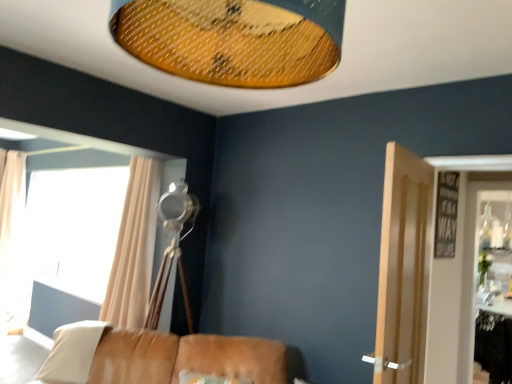
Question: From a real-world perspective, is beige fabric curtain at left, which ranks as the first curtain in left-to-right order, physically below white fabric pillow at lower left?

Choices:
 (A) no
 (B) yes

Answer: (A)

Question: Can you confirm if beige fabric curtain at left, which ranks as the first curtain in left-to-right order, is positioned to the right of white fabric pillow at lower left?

Choices:
 (A) no
 (B) yes

Answer: (A)

Question: Is beige fabric curtain at left, arranged as the 2th curtain when viewed from the right, thinner than white fabric pillow at lower left?

Choices:
 (A) no
 (B) yes

Answer: (B)

Question: Is beige fabric curtain at left, which ranks as the first curtain in left-to-right order, bigger than white fabric pillow at lower left?

Choices:
 (A) no
 (B) yes

Answer: (B)

Question: Is beige fabric curtain at left, which is the 2th curtain from front to back, closer to camera compared to white fabric pillow at lower left?

Choices:
 (A) no
 (B) yes

Answer: (A)

Question: Does beige fabric curtain at left, which ranks as the first curtain in left-to-right order, turn towards white fabric pillow at lower left?

Choices:
 (A) yes
 (B) no

Answer: (B)

Question: Does light brown wooden door at right have a lesser height compared to leather couch at lower center?

Choices:
 (A) yes
 (B) no

Answer: (B)

Question: Is light brown wooden door at right to the right of leather couch at lower center from the viewer's perspective?

Choices:
 (A) yes
 (B) no

Answer: (A)

Question: Could leather couch at lower center be considered to be inside light brown wooden door at right?

Choices:
 (A) no
 (B) yes

Answer: (A)

Question: Is light brown wooden door at right positioned before leather couch at lower center?

Choices:
 (A) no
 (B) yes

Answer: (B)

Question: Is light brown wooden door at right not close to leather couch at lower center?

Choices:
 (A) yes
 (B) no

Answer: (A)

Question: From a real-world perspective, is light brown wooden door at right positioned under leather couch at lower center based on gravity?

Choices:
 (A) yes
 (B) no

Answer: (B)

Question: Would you consider beige fabric curtain at left, arranged as the first curtain when viewed from the right, to be distant from beige fabric curtain at left, which ranks as the first curtain in left-to-right order?

Choices:
 (A) yes
 (B) no

Answer: (A)